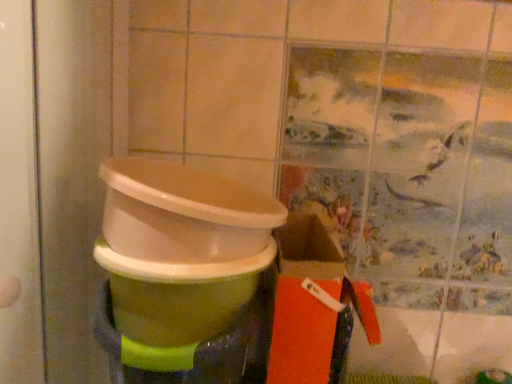
Question: Is green glossy toilet bowl at center positioned beyond the bounds of orange matte box at lower right?

Choices:
 (A) no
 (B) yes

Answer: (B)

Question: Is green glossy toilet bowl at center positioned behind orange matte box at lower right?

Choices:
 (A) yes
 (B) no

Answer: (B)

Question: Is green glossy toilet bowl at center closer to the viewer compared to orange matte box at lower right?

Choices:
 (A) yes
 (B) no

Answer: (A)

Question: Is the surface of green glossy toilet bowl at center in direct contact with orange matte box at lower right?

Choices:
 (A) yes
 (B) no

Answer: (B)

Question: Is green glossy toilet bowl at center far away from orange matte box at lower right?

Choices:
 (A) no
 (B) yes

Answer: (A)

Question: Does green glossy toilet bowl at center have a lesser height compared to orange matte box at lower right?

Choices:
 (A) no
 (B) yes

Answer: (B)

Question: Is orange matte box at lower right aimed at green glossy waste container at center?

Choices:
 (A) no
 (B) yes

Answer: (A)

Question: Is orange matte box at lower right far from green glossy waste container at center?

Choices:
 (A) no
 (B) yes

Answer: (A)

Question: Does orange matte box at lower right have a lesser width compared to green glossy waste container at center?

Choices:
 (A) yes
 (B) no

Answer: (A)

Question: From the image's perspective, is orange matte box at lower right over green glossy waste container at center?

Choices:
 (A) no
 (B) yes

Answer: (A)

Question: Considering the relative sizes of orange matte box at lower right and green glossy waste container at center in the image provided, is orange matte box at lower right smaller than green glossy waste container at center?

Choices:
 (A) no
 (B) yes

Answer: (B)

Question: From a real-world perspective, is orange matte box at lower right located higher than green glossy waste container at center?

Choices:
 (A) no
 (B) yes

Answer: (A)

Question: From the image's perspective, does green glossy waste container at center appear lower than green glossy toilet bowl at center?

Choices:
 (A) yes
 (B) no

Answer: (B)